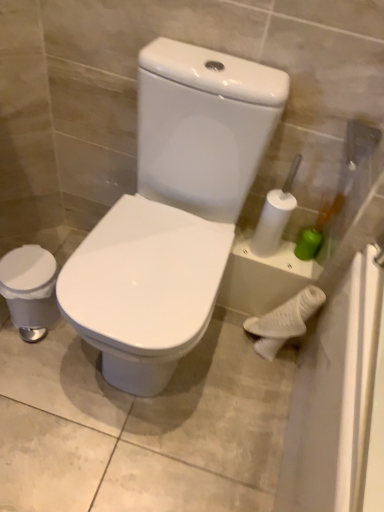
Where is `vacant area that is in front of white matte porcelain at lower right, acting as the 1th porcelain starting from the right`? The image size is (384, 512). vacant area that is in front of white matte porcelain at lower right, acting as the 1th porcelain starting from the right is located at coordinates [x=253, y=392].